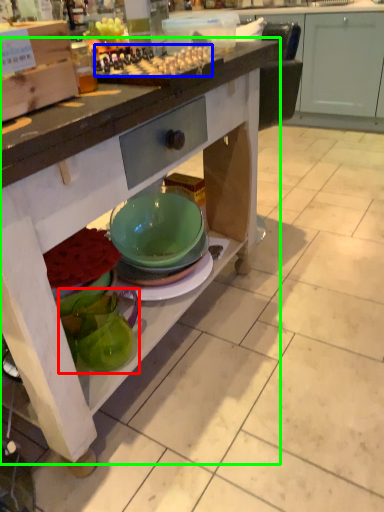
Question: Considering the real-world distances, which object is farthest from tableware (highlighted by a red box)? food (highlighted by a blue box) or table (highlighted by a green box)?

Choices:
 (A) food
 (B) table

Answer: (A)